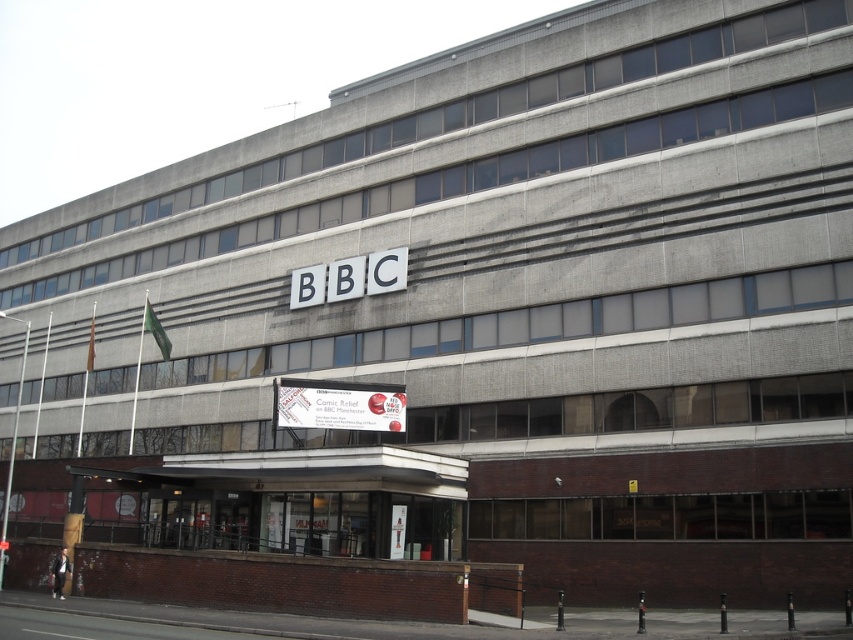
Is point (334, 381) positioned in front of point (386, 285)?

No, (334, 381) is behind (386, 285).

Can you confirm if white plastic sign at center is taller than white plastic bbc sign at center?

In fact, white plastic sign at center may be shorter than white plastic bbc sign at center.

Between point (376, 419) and point (351, 284), which one is positioned in front?

Point (376, 419) is in front.

The image size is (853, 640). Find the location of `white plastic sign at center`. white plastic sign at center is located at coordinates (338, 404).